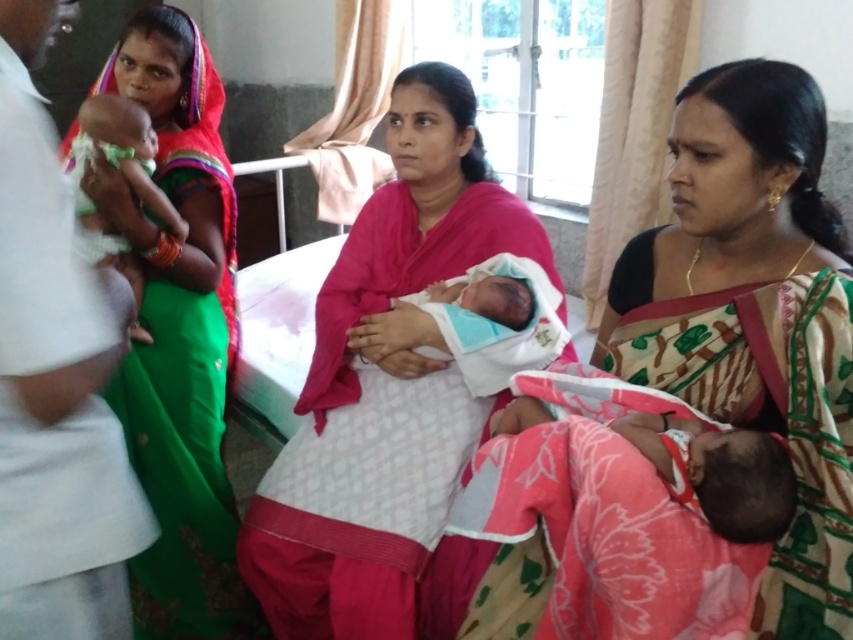
Question: Does green silk saree at left have a larger size compared to soft blue swaddle at center?

Choices:
 (A) no
 (B) yes

Answer: (B)

Question: Among these points, which one is nearest to the camera?

Choices:
 (A) (178, 588)
 (B) (662, 460)

Answer: (B)

Question: Among these points, which one is nearest to the camera?

Choices:
 (A) (523, 422)
 (B) (155, 113)
 (C) (392, 362)

Answer: (A)

Question: Is green silk saree at left further to camera compared to matte green fabric baby at left?

Choices:
 (A) no
 (B) yes

Answer: (B)

Question: Among these objects, which one is farthest from the camera?

Choices:
 (A) matte green fabric baby at left
 (B) green silk saree at left
 (C) soft blue swaddle at center

Answer: (B)

Question: Does pink fabric baby at center have a lesser width compared to soft blue swaddle at center?

Choices:
 (A) no
 (B) yes

Answer: (A)